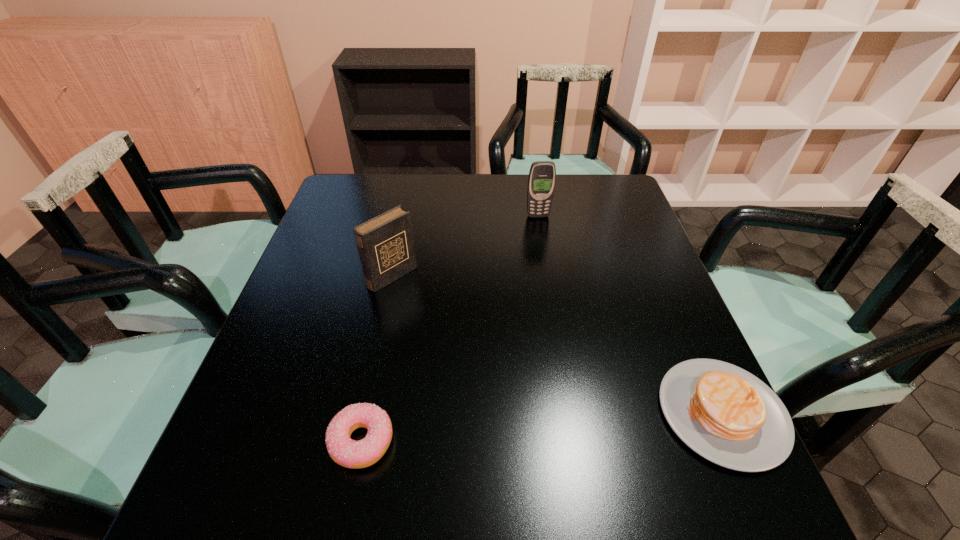
This screenshot has width=960, height=540. In order to click on vacant area situated on the front cover of the diary in this screenshot , I will do `click(471, 340)`.

Where is `vacant area situated on the screen of the cellular telephone`? The height and width of the screenshot is (540, 960). vacant area situated on the screen of the cellular telephone is located at coordinates (547, 251).

Find the location of a particular element. free space located 0.400m on the screen of the cellular telephone is located at coordinates (564, 320).

This screenshot has width=960, height=540. In order to click on free space located on the screen of the cellular telephone in this screenshot , I will do `click(563, 310)`.

Image resolution: width=960 pixels, height=540 pixels. Find the location of `object present at the far edge`. object present at the far edge is located at coordinates (x=541, y=182).

At what (x,y) coordinates should I click in order to perform the action: click on doughnut present at the near edge. Please return your answer as a coordinate pair (x, y). This screenshot has height=540, width=960. Looking at the image, I should click on (346, 452).

What are the coordinates of `pancake at the near edge` in the screenshot? It's located at (725, 414).

Where is `object present at the right edge`? Image resolution: width=960 pixels, height=540 pixels. object present at the right edge is located at coordinates pyautogui.click(x=725, y=414).

Where is `object located in the near right corner section of the desktop`? The width and height of the screenshot is (960, 540). object located in the near right corner section of the desktop is located at coordinates [725, 414].

I want to click on free space at the far edge, so click(x=499, y=206).